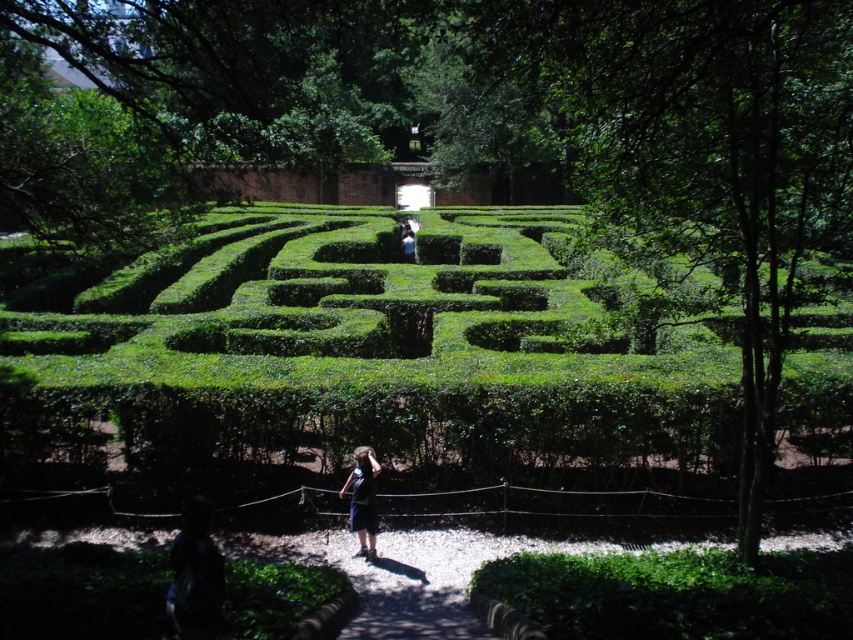
Question: Among these points, which one is farthest from the camera?

Choices:
 (A) (181, 588)
 (B) (401, 243)
 (C) (357, 534)

Answer: (B)

Question: Does dark blue shirt at lower left have a greater width compared to dark blue shirt at center?

Choices:
 (A) no
 (B) yes

Answer: (A)

Question: Which object is farther from the camera taking this photo?

Choices:
 (A) dark blue shirt at center
 (B) dark blue shirt at lower left
 (C) dark blue shorts at lower center

Answer: (A)

Question: Is dark blue shirt at lower left above dark blue shorts at lower center?

Choices:
 (A) yes
 (B) no

Answer: (A)

Question: Does dark blue shirt at lower left have a smaller size compared to dark blue shirt at center?

Choices:
 (A) no
 (B) yes

Answer: (B)

Question: Estimate the real-world distances between objects in this image. Which object is farther from the dark blue shorts at lower center?

Choices:
 (A) dark blue shirt at center
 (B) dark blue shirt at lower left

Answer: (A)